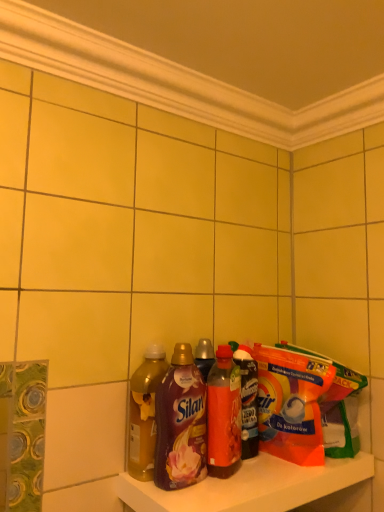
Question: Is translucent plastic bottles at lower center taller or shorter than orange plastic bag at shelf right?

Choices:
 (A) tall
 (B) short

Answer: (B)

Question: In the image, is translucent plastic bottles at lower center positioned in front of or behind orange plastic bag at shelf right?

Choices:
 (A) front
 (B) behind

Answer: (A)

Question: Which object is the farthest from the orange plastic bag at shelf right?

Choices:
 (A) translucent plastic bottles at lower center
 (B) translucent plastic bottle at center, placed as the 4th bottle when sorted from left to right
 (C) matte plastic bottle at center, the 2th bottle from the left
 (D) translucent plastic bottle at center, the second bottle viewed from the right
 (E) translucent amber liquid at shelf center, placed as the first bottle when sorted from left to right

Answer: (E)

Question: Which is nearer to the translucent plastic bottle at center, placed as the 4th bottle when sorted from left to right?

Choices:
 (A) translucent amber liquid at shelf center, which is the fourth bottle from right to left
 (B) orange plastic bag at shelf right
 (C) matte plastic bottle at center, the 2th bottle from the left
 (D) translucent plastic bottles at lower center
 (E) translucent plastic bottle at center, which ranks as the 3th bottle in left-to-right order

Answer: (E)